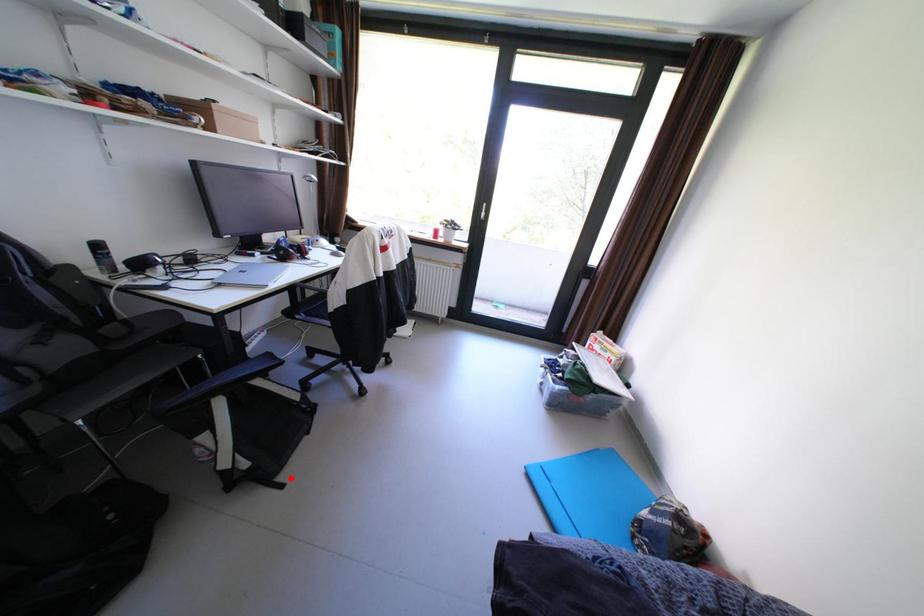
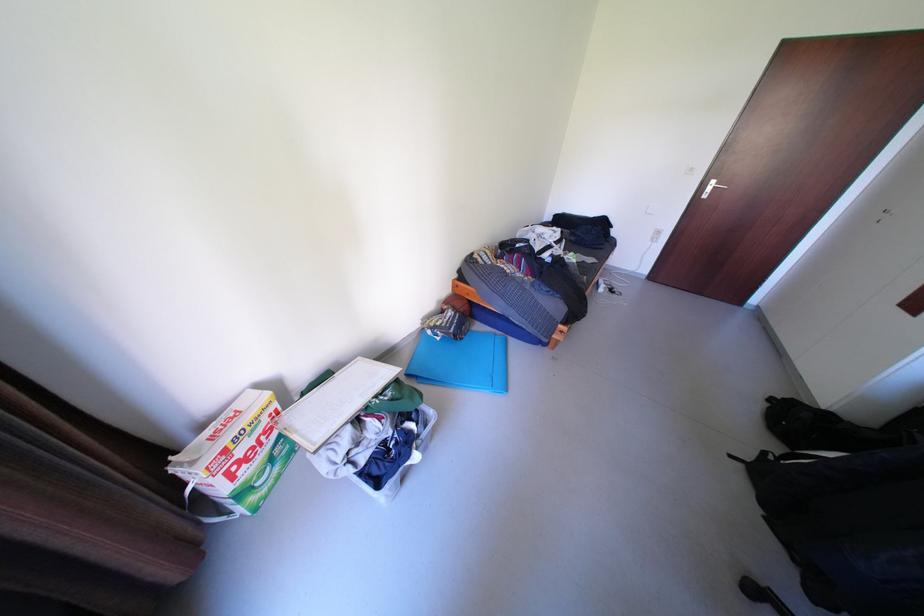
Question: I am providing you with two images of the same scene from different viewpoints. In image1, a red point is highlighted. Considering the same 3D point in image2, which of the following is correct?

Choices:
 (A) It is closer
 (B) It is farther

Answer: (B)